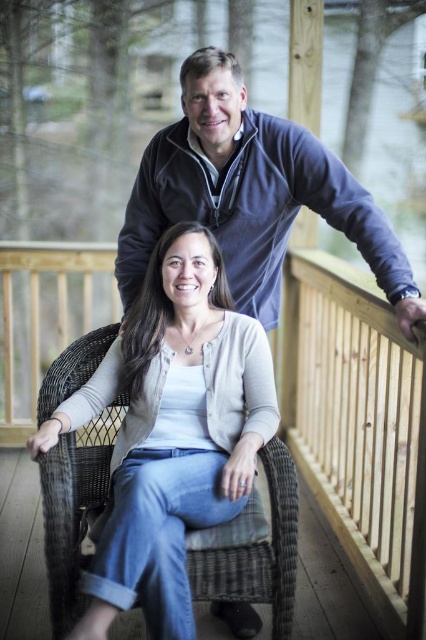
Question: Does light wood railing at upper right appear on the right side of blue fleece sweater at upper center?

Choices:
 (A) no
 (B) yes

Answer: (B)

Question: Considering the real-world distances, which object is farthest from the blue fleece sweater at upper center?

Choices:
 (A) matte gray cardigan at center
 (B) light wood railing at upper right

Answer: (B)

Question: Is matte gray cardigan at center to the left of light wood railing at upper right from the viewer's perspective?

Choices:
 (A) yes
 (B) no

Answer: (A)

Question: Based on their relative distances, which object is nearer to the light wood railing at upper right?

Choices:
 (A) matte gray cardigan at center
 (B) blue fleece sweater at upper center

Answer: (B)

Question: Where is matte gray cardigan at center located in relation to blue fleece sweater at upper center in the image?

Choices:
 (A) left
 (B) right

Answer: (A)

Question: Which point is farther to the camera?

Choices:
 (A) (137, 358)
 (B) (233, 168)
 (C) (325, 332)

Answer: (C)